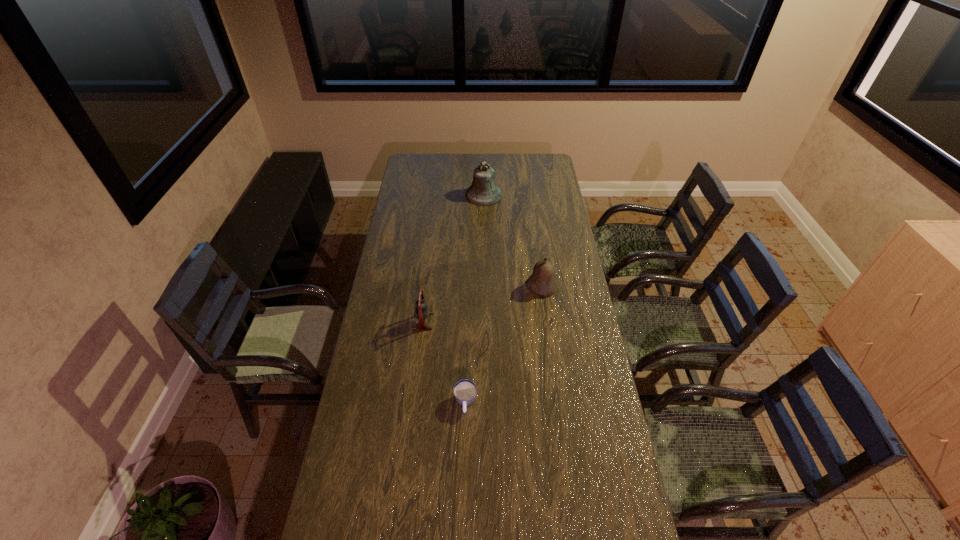
At what (x,y) coordinates should I click in order to perform the action: click on empty location between the rightmost object and the nearest object. Please return your answer as a coordinate pair (x, y). Looking at the image, I should click on (503, 345).

Image resolution: width=960 pixels, height=540 pixels. I want to click on free spot between the second bell from right to left and the shortest object, so click(x=474, y=299).

Locate an element on the screen. The width and height of the screenshot is (960, 540). free space that is in between the tallest bell and the third farthest object is located at coordinates (453, 258).

What are the coordinates of `unoccupied position between the leftmost object and the tallest object` in the screenshot? It's located at (453, 258).

The image size is (960, 540). Find the location of `vacant space that's between the leftmost object and the nearest object`. vacant space that's between the leftmost object and the nearest object is located at coordinates (444, 362).

Locate an element on the screen. the closest object to the second bell from left to right is located at coordinates (541, 282).

Identify which object is the second closest to the farthest object. Please provide its 2D coordinates. Your answer should be formatted as a tuple, i.e. [(x, y)], where the tuple contains the x and y coordinates of a point satisfying the conditions above.

[(421, 312)]

Locate an element on the screen. This screenshot has height=540, width=960. bell that is the second closest one to the leftmost object is located at coordinates (483, 192).

Find the location of a particular element. bell that is the closest one to the cup is located at coordinates (421, 312).

The width and height of the screenshot is (960, 540). Identify the location of free location that satisfies the following two spatial constraints: 1. on the back side of the leftmost bell; 2. on the left side of the farthest bell. pos(438,195).